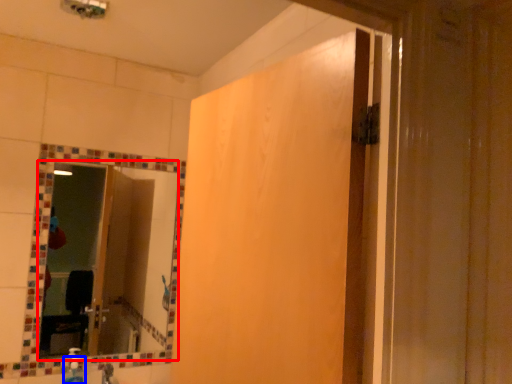
Question: Which point is further to the camera, mirror (highlighted by a red box) or soap dispenser (highlighted by a blue box)?

Choices:
 (A) mirror
 (B) soap dispenser

Answer: (A)